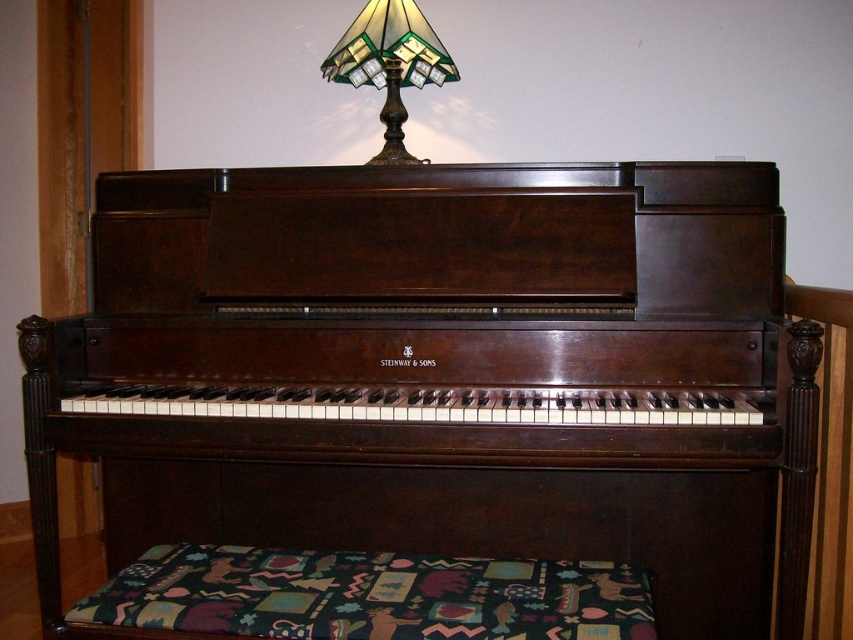
Question: Which object is farther from the camera taking this photo?

Choices:
 (A) stained glass lampshade at upper center
 (B) shiny dark wood piano at center
 (C) dark fabric footrest at lower center

Answer: (A)

Question: Does shiny dark wood piano at center appear over dark fabric footrest at lower center?

Choices:
 (A) yes
 (B) no

Answer: (A)

Question: Which point appears closest to the camera in this image?

Choices:
 (A) (126, 604)
 (B) (389, 112)

Answer: (A)

Question: Does dark fabric footrest at lower center appear on the right side of stained glass lampshade at upper center?

Choices:
 (A) no
 (B) yes

Answer: (A)

Question: Observing the image, what is the correct spatial positioning of shiny dark wood piano at center in reference to stained glass lampshade at upper center?

Choices:
 (A) right
 (B) left

Answer: (A)

Question: Which is farther from the dark fabric footrest at lower center?

Choices:
 (A) shiny dark wood piano at center
 (B) stained glass lampshade at upper center

Answer: (B)